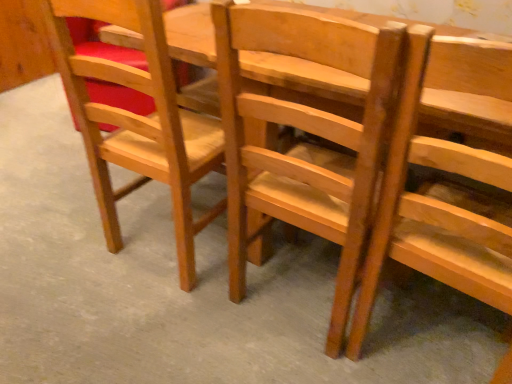
Question: From a real-world perspective, is matte wood chair at left, the first chair in the left-to-right sequence, physically above wooden chair at center, the 1th chair in the right-to-left sequence?

Choices:
 (A) yes
 (B) no

Answer: (B)

Question: Does matte wood chair at left, which is the third chair in right-to-left order, have a greater width compared to wooden chair at center, the 3th chair viewed from the left?

Choices:
 (A) no
 (B) yes

Answer: (B)

Question: Can you confirm if matte wood chair at left, the first chair in the left-to-right sequence, is thinner than wooden chair at center, the 1th chair in the right-to-left sequence?

Choices:
 (A) yes
 (B) no

Answer: (B)

Question: Is matte wood chair at left, the first chair in the left-to-right sequence, completely or partially outside of wooden chair at center, the 1th chair in the right-to-left sequence?

Choices:
 (A) no
 (B) yes

Answer: (B)

Question: From a real-world perspective, is matte wood chair at left, which is the third chair in right-to-left order, beneath wooden chair at center, the 3th chair viewed from the left?

Choices:
 (A) no
 (B) yes

Answer: (B)

Question: Is light brown wood chair at center, the second chair from the right, taller or shorter than matte wood chair at left, which is the third chair in right-to-left order?

Choices:
 (A) short
 (B) tall

Answer: (B)

Question: Is point (375, 49) closer or farther from the camera than point (142, 183)?

Choices:
 (A) farther
 (B) closer

Answer: (B)

Question: Based on their positions, is light brown wood chair at center, the 2th chair in the left-to-right sequence, located to the left or right of matte wood chair at left, the first chair in the left-to-right sequence?

Choices:
 (A) right
 (B) left

Answer: (A)

Question: From a real-world perspective, is light brown wood chair at center, the 2th chair in the left-to-right sequence, above or below matte wood chair at left, the first chair in the left-to-right sequence?

Choices:
 (A) above
 (B) below

Answer: (A)

Question: Is matte wood chair at left, the first chair in the left-to-right sequence, bigger or smaller than wooden chair at center, the 3th chair viewed from the left?

Choices:
 (A) big
 (B) small

Answer: (A)

Question: Is matte wood chair at left, the first chair in the left-to-right sequence, in front of or behind wooden chair at center, the 1th chair in the right-to-left sequence, in the image?

Choices:
 (A) front
 (B) behind

Answer: (B)

Question: From a real-world perspective, is matte wood chair at left, the first chair in the left-to-right sequence, physically located above or below wooden chair at center, the 1th chair in the right-to-left sequence?

Choices:
 (A) below
 (B) above

Answer: (A)

Question: Considering the positions of matte wood chair at left, which is the third chair in right-to-left order, and wooden chair at center, the 3th chair viewed from the left, in the image, is matte wood chair at left, which is the third chair in right-to-left order, taller or shorter than wooden chair at center, the 3th chair viewed from the left,?

Choices:
 (A) tall
 (B) short

Answer: (B)

Question: Relative to wooden chair at center, the 1th chair in the right-to-left sequence, is light brown wood chair at center, the second chair from the right, in front or behind?

Choices:
 (A) front
 (B) behind

Answer: (B)

Question: Is point (338, 327) positioned closer to the camera than point (498, 46)?

Choices:
 (A) farther
 (B) closer

Answer: (A)